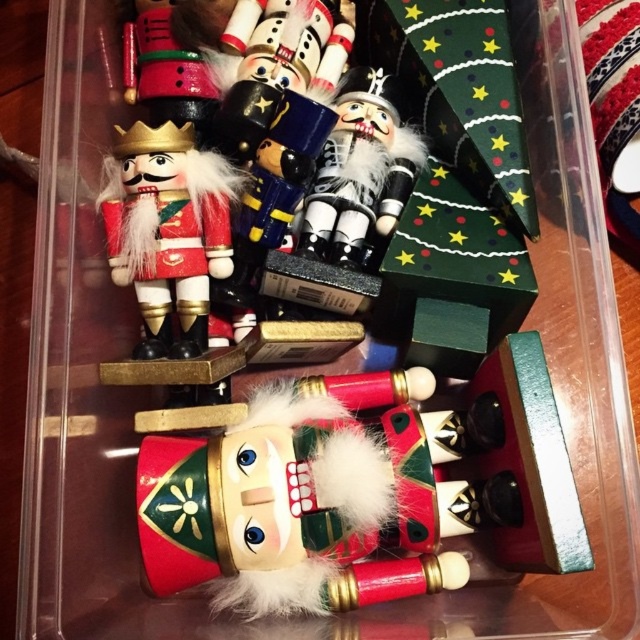
You are a collector who wants to place a new nutcracker figurine between the matte red wood nutcracker at center and the wooden nutcracker at left. The new figurine is 15 centimeters wide. Is there enough space between them to fit it?

The distance between the matte red wood nutcracker at center and the wooden nutcracker at left is 27.17 centimeters. Since the new figurine is 15 centimeters wide, there is sufficient space to place it between them.

You are organizing the nutcracker collection. You need to place a new golden nutcracker between the matte red wood nutcracker at center and the matte black nutcracker at center. Based on their current positions, where should you place the golden nutcracker?

The matte red wood nutcracker at center is positioned under the matte black nutcracker at center, so you should place the golden nutcracker between them either above the red one or below the black one to maintain the vertical arrangement.

You are a collector who wants to display the wooden nutcracker at left and the matte black nutcracker at center on a shelf. Given that the shelf has limited space, which nutcracker should you choose to fit better in the available space?

The matte black nutcracker at center is smaller in size than the wooden nutcracker at left, so it would fit better in the limited space on the shelf.